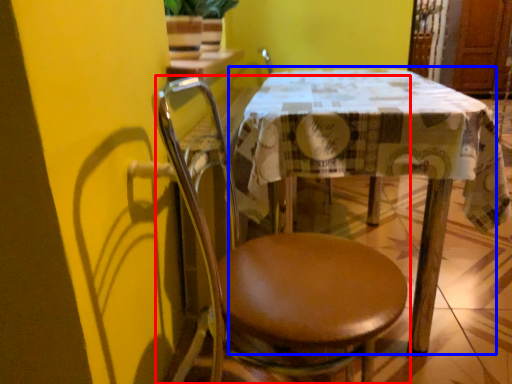
Question: Which point is further to the camera, chair (highlighted by a red box) or table (highlighted by a blue box)?

Choices:
 (A) chair
 (B) table

Answer: (B)